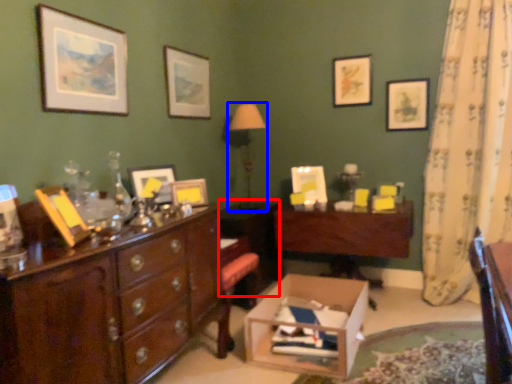
Question: Among these objects, which one is nearest to the camera, cabinetry (highlighted by a red box) or table lamp (highlighted by a blue box)?

Choices:
 (A) cabinetry
 (B) table lamp

Answer: (A)